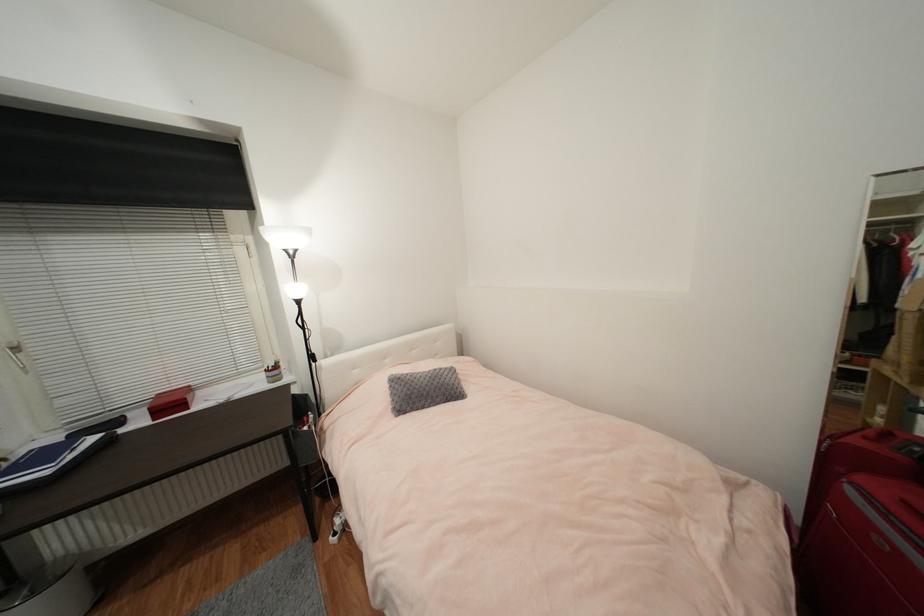
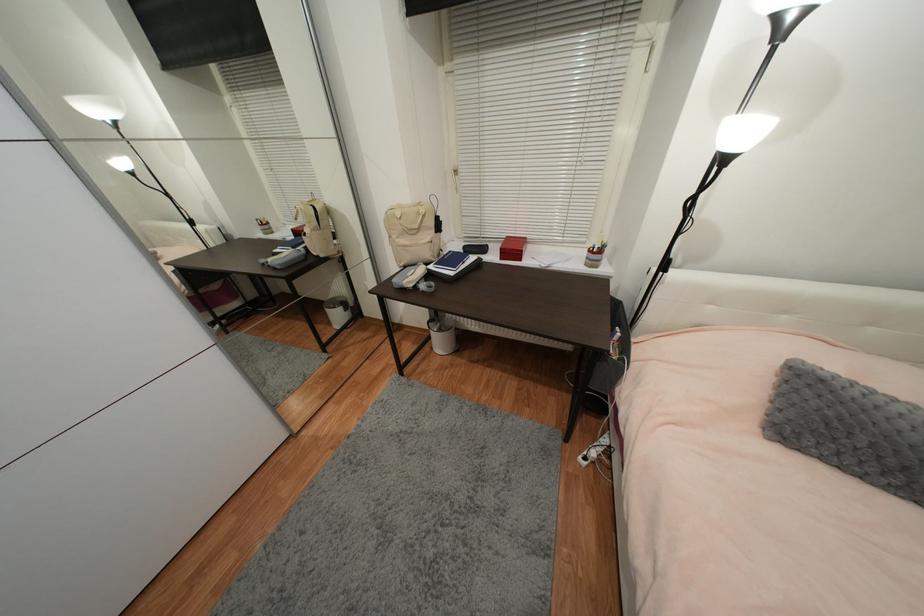
First-person continuous shooting, in which direction is the camera rotating?

The rotation direction of the camera is left-down.